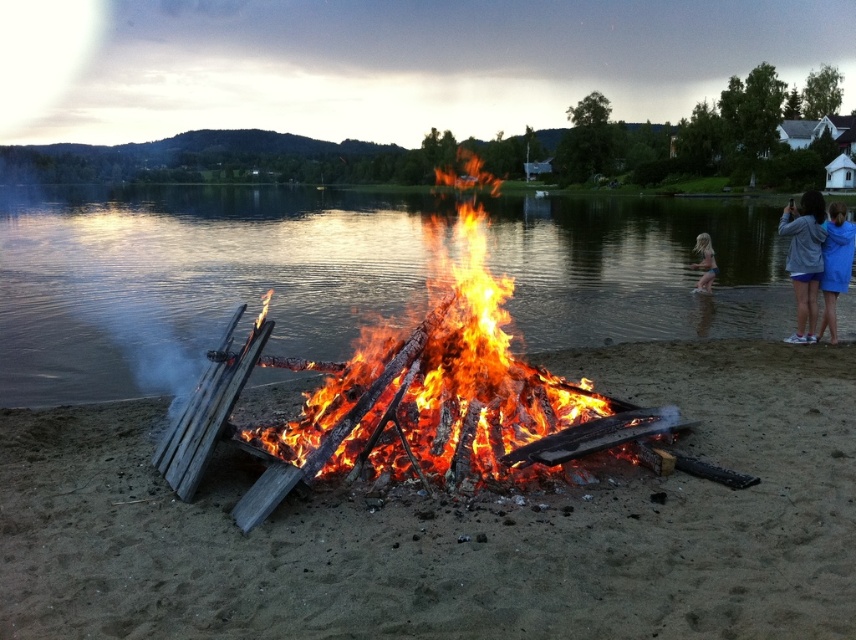
Is brown sandy beach at center positioned behind transparent water at center?

No, brown sandy beach at center is in front of transparent water at center.

Is point (492, 573) positioned before point (745, 259)?

Yes, point (492, 573) is closer to viewer.

The height and width of the screenshot is (640, 856). I want to click on brown sandy beach at center, so click(x=456, y=528).

At what (x,y) coordinates should I click in order to perform the action: click on transparent water at center. Please return your answer as a coordinate pair (x, y). The width and height of the screenshot is (856, 640). Looking at the image, I should click on (189, 280).

Does transparent water at center appear on the left side of gray fabric at right?

Correct, you'll find transparent water at center to the left of gray fabric at right.

Where is `transparent water at center`? Image resolution: width=856 pixels, height=640 pixels. transparent water at center is located at coordinates (189, 280).

Who is positioned more to the right, blue fabric dress at right or light blue denim shorts at lower right?

Positioned to the right is light blue denim shorts at lower right.

Is blue fabric dress at right positioned before light blue denim shorts at lower right?

Yes, it is in front of light blue denim shorts at lower right.

Where is `blue fabric dress at right`? Image resolution: width=856 pixels, height=640 pixels. blue fabric dress at right is located at coordinates (835, 264).